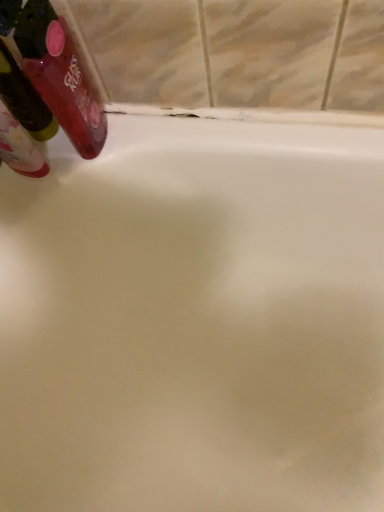
Question: Is translucent plastic mouthwash at upper left, the 1th mouthwash when ordered from left to right, facing away from translucent plastic mouthwash at upper left, arranged as the first mouthwash when viewed from the right?

Choices:
 (A) yes
 (B) no

Answer: (B)

Question: Does translucent plastic mouthwash at upper left, the second mouthwash viewed from the right, have a lesser width compared to translucent plastic mouthwash at upper left, acting as the second mouthwash starting from the left?

Choices:
 (A) no
 (B) yes

Answer: (B)

Question: Is translucent plastic mouthwash at upper left, the 1th mouthwash when ordered from left to right, next to translucent plastic mouthwash at upper left, arranged as the first mouthwash when viewed from the right?

Choices:
 (A) yes
 (B) no

Answer: (A)

Question: Is translucent plastic mouthwash at upper left, the second mouthwash viewed from the right, not inside translucent plastic mouthwash at upper left, acting as the second mouthwash starting from the left?

Choices:
 (A) no
 (B) yes

Answer: (B)

Question: Is translucent plastic mouthwash at upper left, the 1th mouthwash when ordered from left to right, further to the viewer compared to translucent plastic mouthwash at upper left, arranged as the first mouthwash when viewed from the right?

Choices:
 (A) no
 (B) yes

Answer: (B)

Question: Are translucent plastic mouthwash at upper left, the second mouthwash viewed from the right, and translucent plastic mouthwash at upper left, acting as the second mouthwash starting from the left, far apart?

Choices:
 (A) no
 (B) yes

Answer: (A)

Question: Can you confirm if translucent plastic mouthwash at upper left, acting as the second mouthwash starting from the left, is taller than translucent plastic mouthwash at upper left, the 1th mouthwash when ordered from left to right?

Choices:
 (A) yes
 (B) no

Answer: (A)

Question: Is translucent plastic mouthwash at upper left, arranged as the first mouthwash when viewed from the right, shorter than translucent plastic mouthwash at upper left, the second mouthwash viewed from the right?

Choices:
 (A) no
 (B) yes

Answer: (A)

Question: Is translucent plastic mouthwash at upper left, acting as the second mouthwash starting from the left, positioned with its back to translucent plastic mouthwash at upper left, the 1th mouthwash when ordered from left to right?

Choices:
 (A) no
 (B) yes

Answer: (B)

Question: Is translucent plastic mouthwash at upper left, the second mouthwash viewed from the right, completely or partially inside translucent plastic mouthwash at upper left, arranged as the first mouthwash when viewed from the right?

Choices:
 (A) no
 (B) yes

Answer: (A)

Question: From a real-world perspective, is translucent plastic mouthwash at upper left, arranged as the first mouthwash when viewed from the right, physically above translucent plastic mouthwash at upper left, the second mouthwash viewed from the right?

Choices:
 (A) yes
 (B) no

Answer: (A)

Question: Is translucent plastic mouthwash at upper left, arranged as the first mouthwash when viewed from the right, touching translucent plastic mouthwash at upper left, the 1th mouthwash when ordered from left to right?

Choices:
 (A) no
 (B) yes

Answer: (B)

Question: Based on their sizes in the image, would you say translucent plastic mouthwash at upper left, the second mouthwash viewed from the right, is bigger or smaller than translucent plastic mouthwash at upper left, arranged as the first mouthwash when viewed from the right?

Choices:
 (A) big
 (B) small

Answer: (B)